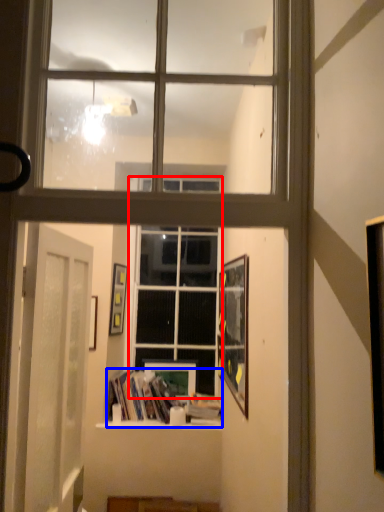
Question: Which point is closer to the camera, window (highlighted by a red box) or book (highlighted by a blue box)?

Choices:
 (A) window
 (B) book

Answer: (B)